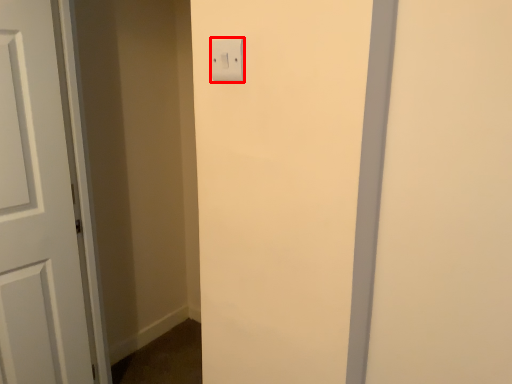
Question: In this image, where is light switch (annotated by the red box) located relative to door?

Choices:
 (A) right
 (B) left

Answer: (A)